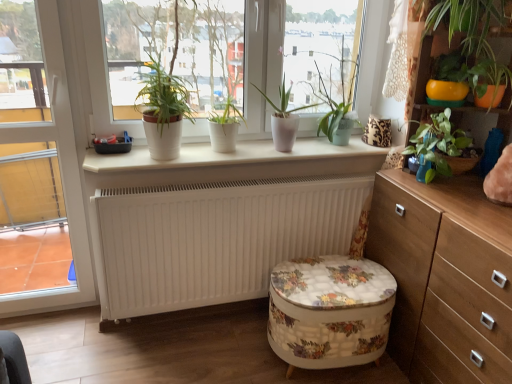
Question: From the image's perspective, is white matte plant pots at center on top of yellow plastic bowl at upper right?

Choices:
 (A) yes
 (B) no

Answer: (A)

Question: Is white matte plant pots at center outside of yellow plastic bowl at upper right?

Choices:
 (A) no
 (B) yes

Answer: (B)

Question: Can you confirm if white matte plant pots at center is taller than yellow plastic bowl at upper right?

Choices:
 (A) no
 (B) yes

Answer: (B)

Question: Is white matte plant pots at center in contact with yellow plastic bowl at upper right?

Choices:
 (A) yes
 (B) no

Answer: (B)

Question: Considering the relative sizes of white matte plant pots at center and yellow plastic bowl at upper right in the image provided, is white matte plant pots at center bigger than yellow plastic bowl at upper right?

Choices:
 (A) no
 (B) yes

Answer: (B)

Question: Would you consider white matte plant pots at center to be distant from yellow plastic bowl at upper right?

Choices:
 (A) no
 (B) yes

Answer: (A)

Question: Is the position of green glossy plant at upper right, which is the fourth houseplant in left-to-right order, more distant than that of orange plastic pot at upper right, positioned as the 1th houseplant in right-to-left order?

Choices:
 (A) yes
 (B) no

Answer: (A)

Question: Does green glossy plant at upper right, the second houseplant positioned from the right, have a larger size compared to orange plastic pot at upper right, positioned as the 1th houseplant in right-to-left order?

Choices:
 (A) yes
 (B) no

Answer: (A)

Question: Does green glossy plant at upper right, which is the fourth houseplant in left-to-right order, have a smaller size compared to orange plastic pot at upper right, marked as the 5th houseplant in a left-to-right arrangement?

Choices:
 (A) no
 (B) yes

Answer: (A)

Question: Does green glossy plant at upper right, which is the fourth houseplant in left-to-right order, appear on the right side of orange plastic pot at upper right, marked as the 5th houseplant in a left-to-right arrangement?

Choices:
 (A) no
 (B) yes

Answer: (A)

Question: From a real-world perspective, does green glossy plant at upper right, which is the fourth houseplant in left-to-right order, stand above orange plastic pot at upper right, positioned as the 1th houseplant in right-to-left order?

Choices:
 (A) yes
 (B) no

Answer: (B)

Question: From the image's perspective, is green glossy plant at upper right, the second houseplant positioned from the right, located above orange plastic pot at upper right, positioned as the 1th houseplant in right-to-left order?

Choices:
 (A) no
 (B) yes

Answer: (A)

Question: Is white matte plant pots at center at the left side of wooden chest of drawers at right?

Choices:
 (A) yes
 (B) no

Answer: (A)